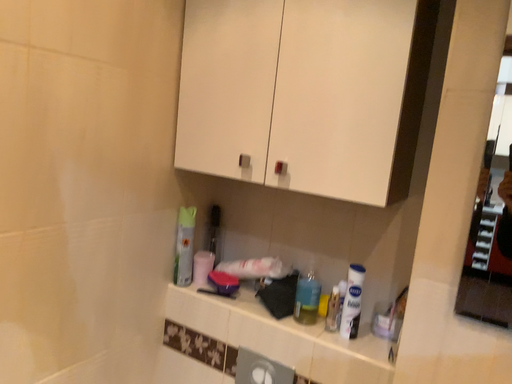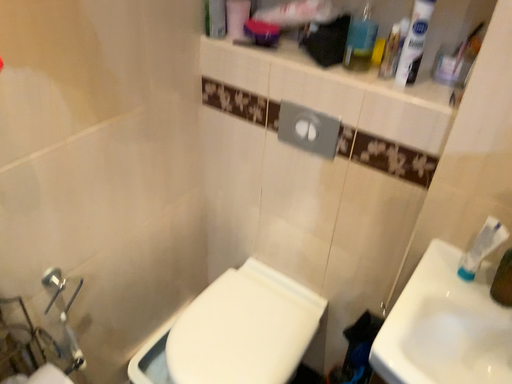
Question: Which way did the camera rotate in the video?

Choices:
 (A) rotated upward
 (B) rotated downward

Answer: (B)